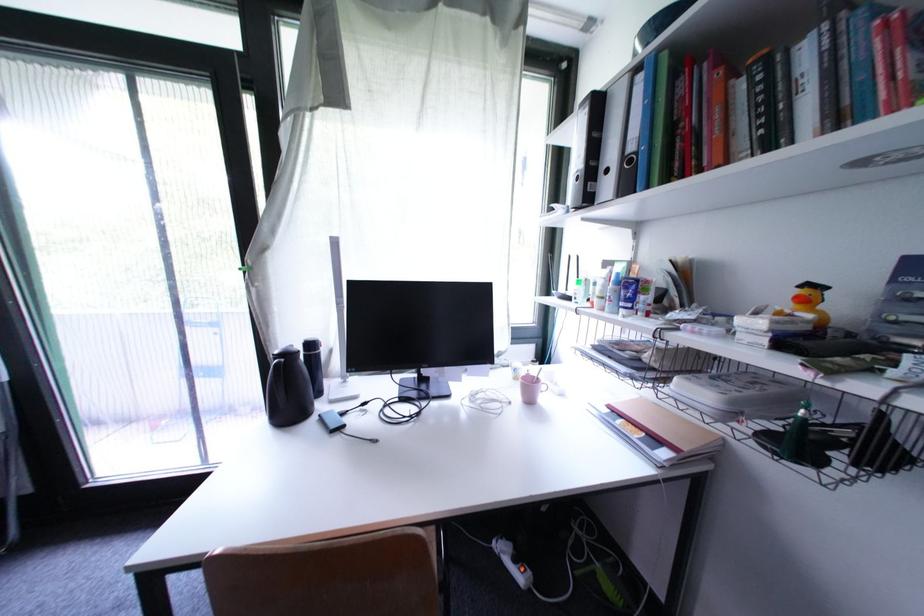
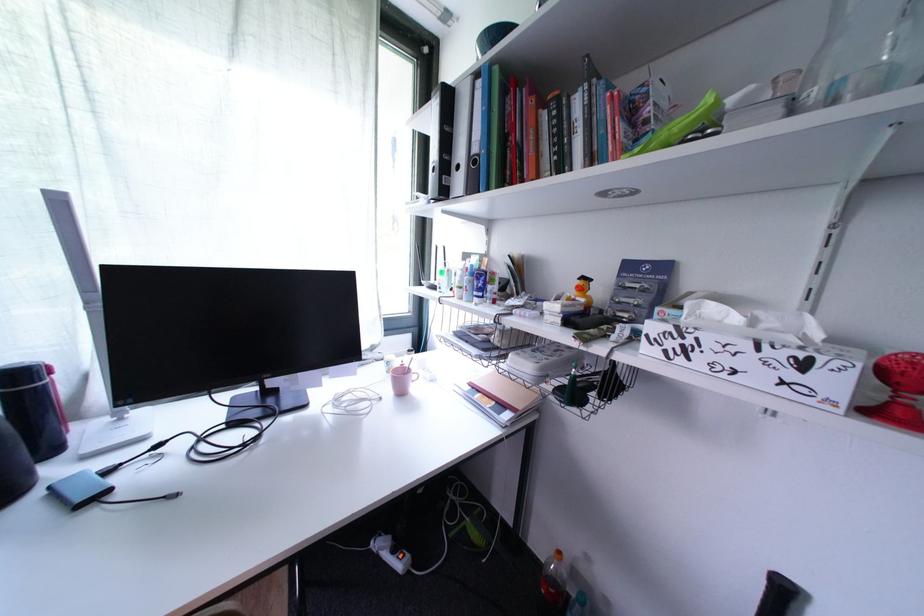
Find the pixel in the second image that matches point 523,562 in the first image.

(402, 553)